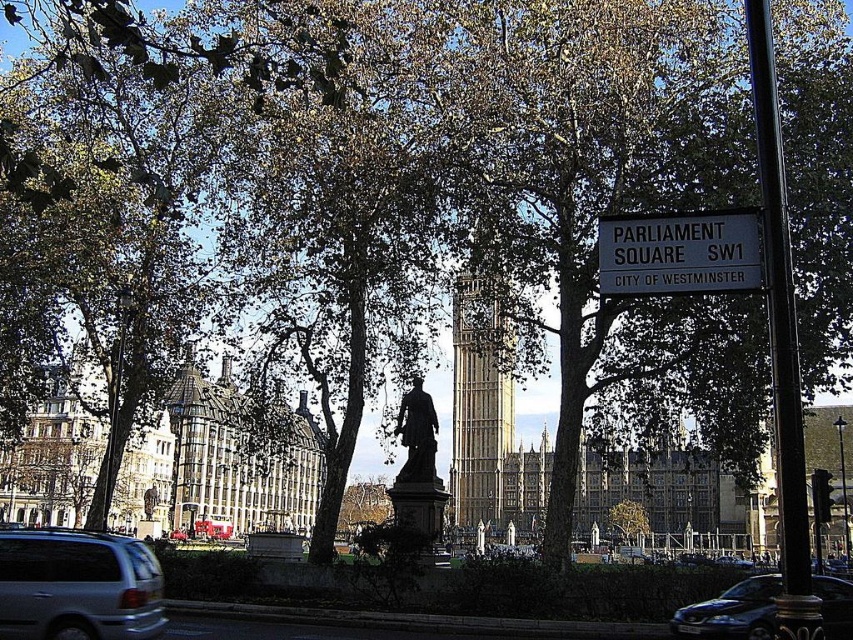
You are standing in front of the golden stone clock tower at center and the white plastic sign at upper center in Parliament Square. Which object is closer to your right side?

The white plastic sign at upper center is closer to your right side since the golden stone clock tower at center is to the left of it.